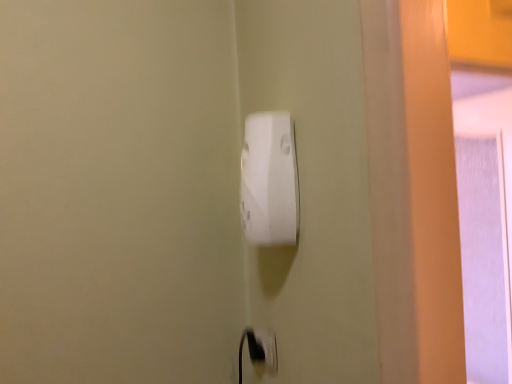
The image size is (512, 384). What do you see at coordinates (269, 180) in the screenshot?
I see `white plastic socket at center` at bounding box center [269, 180].

You are a GUI agent. You are given a task and a screenshot of the screen. Output one action in this format:
    pyautogui.click(x=<x>, y=<y>)
    Task: Click on the white plastic socket at center
    
    Given the screenshot: What is the action you would take?
    pos(269,180)

Image resolution: width=512 pixels, height=384 pixels. What do you see at coordinates (260, 350) in the screenshot? I see `white plastic electric outlet at lower center` at bounding box center [260, 350].

Find the location of a particular element. white plastic electric outlet at lower center is located at coordinates (260, 350).

Find the location of `white plastic socket at center`. white plastic socket at center is located at coordinates (269, 180).

Does white plastic socket at center appear on the left side of white plastic electric outlet at lower center?

Indeed, white plastic socket at center is positioned on the left side of white plastic electric outlet at lower center.

Which is in front, white plastic socket at center or white plastic electric outlet at lower center?

Positioned in front is white plastic socket at center.

Does point (287, 136) appear closer or farther from the camera than point (259, 338)?

Point (287, 136) is closer to the camera than point (259, 338).

From the image's perspective, does white plastic socket at center appear higher than white plastic electric outlet at lower center?

Yes, from the image's perspective, white plastic socket at center is above white plastic electric outlet at lower center.

From a real-world perspective, is white plastic socket at center positioned above or below white plastic electric outlet at lower center?

Clearly, from a real-world perspective, white plastic socket at center is above white plastic electric outlet at lower center.

Between white plastic socket at center and white plastic electric outlet at lower center, which one has smaller width?

With smaller width is white plastic electric outlet at lower center.

Can you confirm if white plastic socket at center is taller than white plastic electric outlet at lower center?

Correct, white plastic socket at center is much taller as white plastic electric outlet at lower center.

Is white plastic socket at center bigger than white plastic electric outlet at lower center?

Indeed, white plastic socket at center has a larger size compared to white plastic electric outlet at lower center.

Is white plastic socket at center outside of white plastic electric outlet at lower center?

white plastic socket at center is positioned outside white plastic electric outlet at lower center.

From the picture: Would you say white plastic socket at center is a long distance from white plastic electric outlet at lower center?

white plastic socket at center is actually quite close to white plastic electric outlet at lower center.

Consider the image. Is white plastic socket at center facing away from white plastic electric outlet at lower center?

white plastic socket at center is not turned away from white plastic electric outlet at lower center.

What's the angular difference between white plastic socket at center and white plastic electric outlet at lower center's facing directions?

They differ by 0.631 degrees in their facing directions.

How much distance is there between white plastic socket at center and white plastic electric outlet at lower center?

white plastic socket at center and white plastic electric outlet at lower center are 11.07 inches apart from each other.

The height and width of the screenshot is (384, 512). I want to click on electric outlet beneath the white plastic socket at center (from a real-world perspective), so tap(260, 350).

In the scene shown: Visually, is white plastic electric outlet at lower center positioned to the left or to the right of white plastic socket at center?

Based on their positions, white plastic electric outlet at lower center is located to the right of white plastic socket at center.

Which is in front, white plastic electric outlet at lower center or white plastic socket at center?

white plastic socket at center is more forward.

Is point (265, 339) closer or farther from the camera than point (252, 239)?

Point (265, 339).

From the image's perspective, does white plastic electric outlet at lower center appear lower than white plastic socket at center?

Yes, from the image's perspective, white plastic electric outlet at lower center is below white plastic socket at center.

From a real-world perspective, between white plastic electric outlet at lower center and white plastic socket at center, who is vertically lower?

white plastic electric outlet at lower center, from a real-world perspective.

Looking at this image, considering the sizes of white plastic electric outlet at lower center and white plastic socket at center in the image, is white plastic electric outlet at lower center wider or thinner than white plastic socket at center?

white plastic electric outlet at lower center is thinner than white plastic socket at center.

Which of these two, white plastic electric outlet at lower center or white plastic socket at center, stands shorter?

white plastic electric outlet at lower center.

Between white plastic electric outlet at lower center and white plastic socket at center, which one has smaller size?

With smaller size is white plastic electric outlet at lower center.

Is white plastic electric outlet at lower center situated inside white plastic socket at center or outside?

white plastic electric outlet at lower center is outside white plastic socket at center.

Is white plastic electric outlet at lower center beside white plastic socket at center?

No.

Is white plastic electric outlet at lower center turned away from white plastic socket at center?

No, white plastic electric outlet at lower center is not facing away from white plastic socket at center.

Can you tell me how much white plastic electric outlet at lower center and white plastic socket at center differ in facing direction?

0.631 degrees separate the facing orientations of white plastic electric outlet at lower center and white plastic socket at center.

Where is `power plugs and sockets that is in front of the white plastic electric outlet at lower center`? power plugs and sockets that is in front of the white plastic electric outlet at lower center is located at coordinates (269, 180).

Identify the location of power plugs and sockets located in front of the white plastic electric outlet at lower center. (269, 180).

At what (x,y) coordinates should I click in order to perform the action: click on power plugs and sockets above the white plastic electric outlet at lower center (from a real-world perspective). Please return your answer as a coordinate pair (x, y). The image size is (512, 384). Looking at the image, I should click on (269, 180).